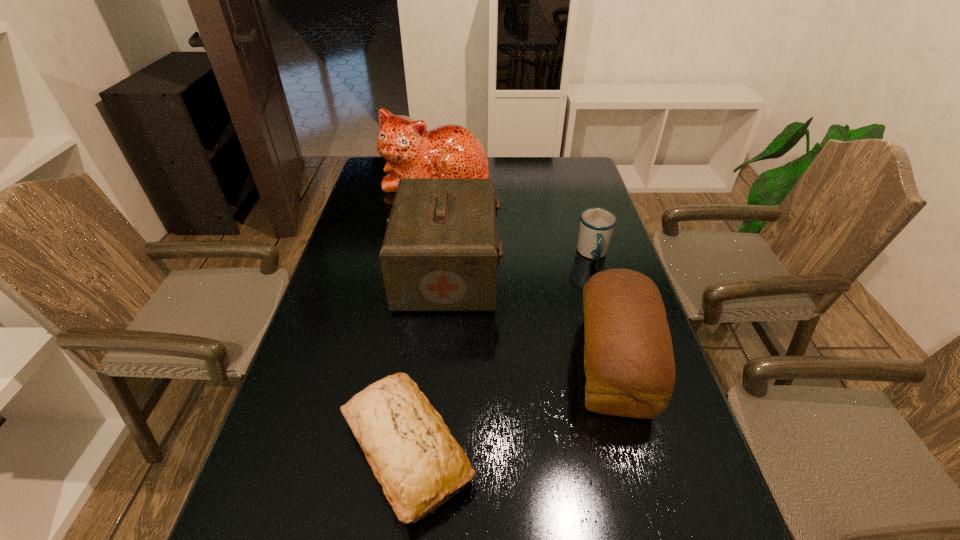
Find the location of a particular element. The height and width of the screenshot is (540, 960). free spot between the cat and the mug is located at coordinates (515, 217).

Locate an element on the screen. blank region between the first-aid kit and the right bread is located at coordinates (531, 318).

The height and width of the screenshot is (540, 960). Identify the location of unoccupied area between the mug and the cat. (515, 217).

You are a GUI agent. You are given a task and a screenshot of the screen. Output one action in this format:
    pyautogui.click(x=<x>, y=<y>)
    Task: Click on the vacant area that lies between the first-aid kit and the mug
    The width and height of the screenshot is (960, 540).
    Given the screenshot: What is the action you would take?
    pyautogui.click(x=520, y=262)

This screenshot has width=960, height=540. What are the coordinates of `vacant area between the mug and the first-aid kit` in the screenshot? It's located at (520, 262).

The image size is (960, 540). Identify the location of empty space that is in between the taller bread and the cat. (525, 272).

Locate an element on the screen. This screenshot has width=960, height=540. vacant point located between the left bread and the mug is located at coordinates (500, 352).

Image resolution: width=960 pixels, height=540 pixels. What are the coordinates of `empty location between the farthest object and the third tallest object` in the screenshot? It's located at (525, 272).

In order to click on object that is the third nearest to the first-aid kit in this screenshot , I will do `click(413, 455)`.

What are the coordinates of `object that is the closest one to the first-aid kit` in the screenshot? It's located at (629, 363).